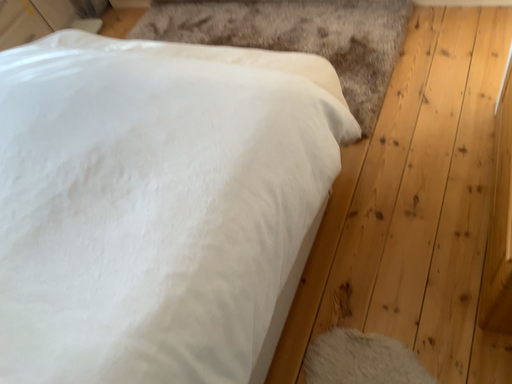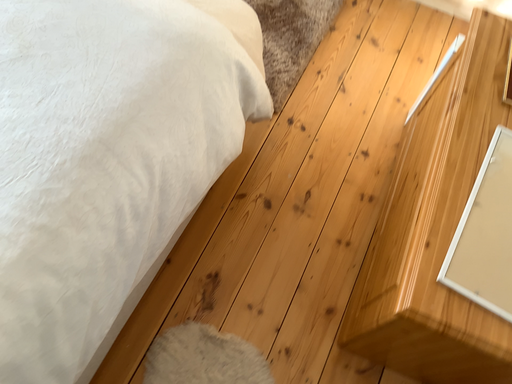
Question: Which way did the camera rotate in the video?

Choices:
 (A) rotated upward
 (B) rotated downward

Answer: (B)